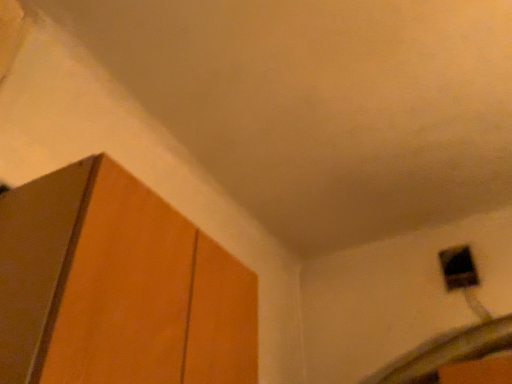
This screenshot has width=512, height=384. What do you see at coordinates (117, 287) in the screenshot? I see `matte wood cabinet at left` at bounding box center [117, 287].

Where is `matte wood cabinet at left`? matte wood cabinet at left is located at coordinates [117, 287].

Measure the distance between point (454, 247) and camera.

Point (454, 247) is 1.96 meters away from camera.

What is the approximate height of black matte window at upper right?

black matte window at upper right is 7.08 inches tall.

Identify the location of black matte window at upper right. (458, 268).

What do you see at coordinates (458, 268) in the screenshot?
I see `black matte window at upper right` at bounding box center [458, 268].

At what (x,y) coordinates should I click in order to perform the action: click on matte wood cabinet at left. Please return your answer as a coordinate pair (x, y). Looking at the image, I should click on (117, 287).

Is matte wood cabinet at left to the left of black matte window at upper right from the viewer's perspective?

Yes.

Relative to black matte window at upper right, is matte wood cabinet at left in front or behind?

In the image, matte wood cabinet at left appears in front of black matte window at upper right.

Between point (46, 280) and point (460, 246), which one is positioned behind?

Point (460, 246)

From the image's perspective, relative to black matte window at upper right, is matte wood cabinet at left above or below?

matte wood cabinet at left is situated higher than black matte window at upper right in the image.

From a real-world perspective, who is located higher, matte wood cabinet at left or black matte window at upper right?

black matte window at upper right.

Is matte wood cabinet at left thinner than black matte window at upper right?

In fact, matte wood cabinet at left might be wider than black matte window at upper right.

Does matte wood cabinet at left have a lesser height compared to black matte window at upper right?

No.

Does matte wood cabinet at left have a larger size compared to black matte window at upper right?

Indeed, matte wood cabinet at left has a larger size compared to black matte window at upper right.

Would you say matte wood cabinet at left is outside black matte window at upper right?

matte wood cabinet at left lies outside black matte window at upper right's area.

Can you see matte wood cabinet at left touching black matte window at upper right?

They are not placed beside each other.

Is matte wood cabinet at left facing towards black matte window at upper right?

No.

Where is `cabinetry on the left side of black matte window at upper right`? cabinetry on the left side of black matte window at upper right is located at coordinates (117, 287).

Is black matte window at upper right to the right of matte wood cabinet at left from the viewer's perspective?

Indeed, black matte window at upper right is positioned on the right side of matte wood cabinet at left.

Which object is further away from the camera, black matte window at upper right or matte wood cabinet at left?

black matte window at upper right.

Considering the positions of point (456, 261) and point (133, 263), is point (456, 261) closer or farther from the camera than point (133, 263)?

Clearly, point (456, 261) is more distant from the camera than point (133, 263).

From the image's perspective, does black matte window at upper right appear higher than matte wood cabinet at left?

No, from the image's perspective, black matte window at upper right is not above matte wood cabinet at left.

From a real-world perspective, between black matte window at upper right and matte wood cabinet at left, who is vertically higher?

black matte window at upper right.

In the scene shown: Which object is thinner, black matte window at upper right or matte wood cabinet at left?

black matte window at upper right.

Considering the relative sizes of black matte window at upper right and matte wood cabinet at left in the image provided, is black matte window at upper right taller than matte wood cabinet at left?

No.

Consider the image. Is black matte window at upper right bigger or smaller than matte wood cabinet at left?

In the image, black matte window at upper right appears to be smaller than matte wood cabinet at left.

Is black matte window at upper right positioned beyond the bounds of matte wood cabinet at left?

Yes, black matte window at upper right is not within matte wood cabinet at left.

Are black matte window at upper right and matte wood cabinet at left beside each other?

No, black matte window at upper right is not with matte wood cabinet at left.

Is black matte window at upper right oriented away from matte wood cabinet at left?

No, black matte window at upper right's orientation is not away from matte wood cabinet at left.

What's the angular difference between black matte window at upper right and matte wood cabinet at left's facing directions?

The angular difference between black matte window at upper right and matte wood cabinet at left is 90.9 degrees.

What are the coordinates of `window located above the matte wood cabinet at left (from a real-world perspective)` in the screenshot? It's located at click(x=458, y=268).

Find the location of a particular element. Image resolution: width=512 pixels, height=384 pixels. cabinetry below the black matte window at upper right (from a real-world perspective) is located at coordinates (117, 287).

The height and width of the screenshot is (384, 512). I want to click on cabinetry on the left of black matte window at upper right, so click(x=117, y=287).